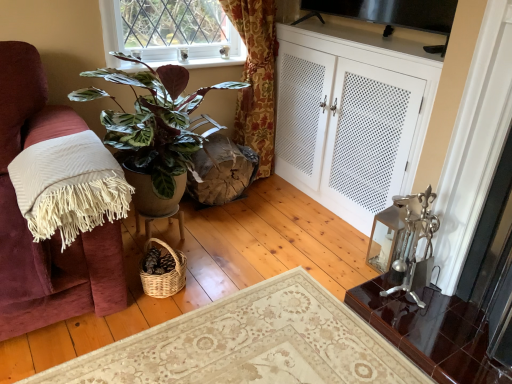
What do you see at coordinates (158, 129) in the screenshot? I see `green glossy plant at left` at bounding box center [158, 129].

I want to click on white fringed blanket at left, so click(x=69, y=186).

What do you see at coordinates (221, 171) in the screenshot? This screenshot has width=512, height=384. I see `matte brown swivel chair at center` at bounding box center [221, 171].

Image resolution: width=512 pixels, height=384 pixels. Identify the location of green leafy plant at upper center. (200, 62).

You are a GUI agent. You are given a task and a screenshot of the screen. Output one action in this format:
    pyautogui.click(x=<x>, y=<y>)
    Task: Click on the white perforated cabinet at right
    
    Given the screenshot: What is the action you would take?
    pyautogui.click(x=351, y=115)

Where is `glossy dark brown desk at lower right`? The height and width of the screenshot is (384, 512). glossy dark brown desk at lower right is located at coordinates (431, 332).

Is matte brown swivel chair at center positioned far away from green leafy plant at upper center?

No, matte brown swivel chair at center is not far away from green leafy plant at upper center.

Is matte brown swivel chair at center to the left or to the right of green leafy plant at upper center in the image?

Clearly, matte brown swivel chair at center is on the right of green leafy plant at upper center in the image.

In terms of height, does matte brown swivel chair at center look taller or shorter compared to green leafy plant at upper center?

Clearly, matte brown swivel chair at center is taller compared to green leafy plant at upper center.

Is point (239, 196) positioned after point (127, 57)?

Yes.

This screenshot has height=384, width=512. What are the coordinates of `desk located below the matte brown swivel chair at center (from the image's perspective)` in the screenshot? It's located at (431, 332).

Can you confirm if glossy dark brown desk at lower right is wider than matte brown swivel chair at center?

Correct, the width of glossy dark brown desk at lower right exceeds that of matte brown swivel chair at center.

Based on the photo, from the image's perspective, is glossy dark brown desk at lower right located above matte brown swivel chair at center?

Actually, glossy dark brown desk at lower right appears below matte brown swivel chair at center in the image.

From the picture: From a real-world perspective, is glossy dark brown desk at lower right positioned above or below matte brown swivel chair at center?

From a real-world perspective, glossy dark brown desk at lower right is physically below matte brown swivel chair at center.

From a real-world perspective, does white fringed blanket at left stand above matte brown swivel chair at center?

Yes.

How many degrees apart are the facing directions of white fringed blanket at left and matte brown swivel chair at center?

white fringed blanket at left and matte brown swivel chair at center are facing 2.62 degrees away from each other.

Is white fringed blanket at left spatially inside matte brown swivel chair at center, or outside of it?

The correct answer is: outside.

From a real-world perspective, which is physically above, white fringed blanket at left or glossy dark brown desk at lower right?

In real-world perspective, white fringed blanket at left is above.

Considering the sizes of objects white fringed blanket at left and glossy dark brown desk at lower right in the image provided, who is shorter, white fringed blanket at left or glossy dark brown desk at lower right?

glossy dark brown desk at lower right.

I want to click on desk located behind the white fringed blanket at left, so click(431, 332).

From a real-world perspective, which is physically below, glossy dark brown desk at lower right or white perforated cabinet at right?

glossy dark brown desk at lower right.

Which object is closer to the camera taking this photo, glossy dark brown desk at lower right or white perforated cabinet at right?

glossy dark brown desk at lower right is closer to the camera.

Consider the image. From the image's perspective, which one is positioned lower, green glossy plant at left or white fringed blanket at left?

white fringed blanket at left is shown below in the image.

Can you confirm if green glossy plant at left is shorter than white fringed blanket at left?

No, green glossy plant at left is not shorter than white fringed blanket at left.

In the scene shown: Which point is more distant from viewer, (177, 166) or (114, 165)?

Point (177, 166)

In terms of width, does green glossy plant at left look wider or thinner when compared to white fringed blanket at left?

In the image, green glossy plant at left appears to be wider than white fringed blanket at left.

In the image, there is a matte brown swivel chair at center. Where is `blanket below it (from the image's perspective)`? blanket below it (from the image's perspective) is located at coordinates (69, 186).

From the image's perspective, is matte brown swivel chair at center located above or below white fringed blanket at left?

From the image's perspective, matte brown swivel chair at center appears above white fringed blanket at left.

Can you see matte brown swivel chair at center touching white fringed blanket at left?

No, matte brown swivel chair at center is not touching white fringed blanket at left.

Could you tell me if matte brown swivel chair at center is facing white fringed blanket at left?

No, matte brown swivel chair at center is not aimed at white fringed blanket at left.

Locate an element on the screen. window sill in front of the matte brown swivel chair at center is located at coordinates (200, 62).

This screenshot has width=512, height=384. Find the location of `desk located on the right of matte brown swivel chair at center`. desk located on the right of matte brown swivel chair at center is located at coordinates (431, 332).

Based on their spatial positions, is glossy dark brown desk at lower right or white perforated cabinet at right closer to white fringed blanket at left?

Based on the image, glossy dark brown desk at lower right appears to be nearer to white fringed blanket at left.

Based on their spatial positions, is matte brown swivel chair at center or glossy dark brown desk at lower right closer to white perforated cabinet at right?

matte brown swivel chair at center is positioned closer to the anchor white perforated cabinet at right.

Looking at this image, based on their spatial positions, is white fringed blanket at left or green leafy plant at upper center closer to matte brown swivel chair at center?

Based on the image, green leafy plant at upper center appears to be nearer to matte brown swivel chair at center.

Estimate the real-world distances between objects in this image. Which object is further from white fringed blanket at left, green leafy plant at upper center or white perforated cabinet at right?

white perforated cabinet at right is further to white fringed blanket at left.

When comparing their distances from glossy dark brown desk at lower right, does white fringed blanket at left or matte brown swivel chair at center seem closer?

Among the two, matte brown swivel chair at center is located nearer to glossy dark brown desk at lower right.

Estimate the real-world distances between objects in this image. Which object is further from glossy dark brown desk at lower right, white perforated cabinet at right or matte brown swivel chair at center?

matte brown swivel chair at center lies further to glossy dark brown desk at lower right than the other object.

From the image, which object appears to be farther from green leafy plant at upper center, green glossy plant at left or white fringed blanket at left?

white fringed blanket at left is further to green leafy plant at upper center.

Estimate the real-world distances between objects in this image. Which object is further from glossy dark brown desk at lower right, green leafy plant at upper center or white perforated cabinet at right?

green leafy plant at upper center.

Identify the location of window sill between white fringed blanket at left and glossy dark brown desk at lower right from left to right. This screenshot has height=384, width=512. (200, 62).

I want to click on cabinetry between matte brown swivel chair at center and glossy dark brown desk at lower right from left to right, so click(x=351, y=115).

You are a GUI agent. You are given a task and a screenshot of the screen. Output one action in this format:
    pyautogui.click(x=<x>, y=<y>)
    Task: Click on the cabinetry located between green glossy plant at left and glossy dark brown desk at lower right in the left-right direction
    This screenshot has height=384, width=512.
    Given the screenshot: What is the action you would take?
    pyautogui.click(x=351, y=115)

Locate an element on the screen. This screenshot has height=384, width=512. houseplant positioned between white fringed blanket at left and matte brown swivel chair at center from near to far is located at coordinates (158, 129).